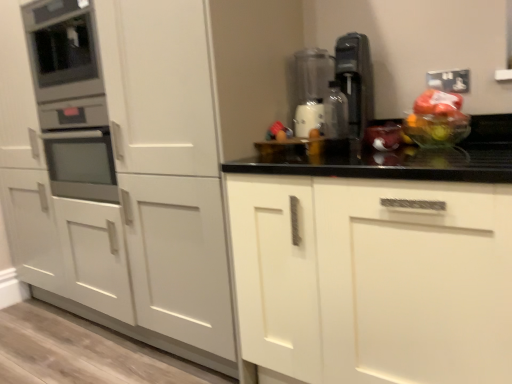
Question: From the image's perspective, is translucent plastic bag at center on metallic oven at left, positioned as the 1th appliance in left-to-right order?

Choices:
 (A) no
 (B) yes

Answer: (A)

Question: Is translucent plastic bag at center not inside metallic oven at left, placed as the second appliance when sorted from right to left?

Choices:
 (A) yes
 (B) no

Answer: (A)

Question: Does translucent plastic bag at center have a lesser width compared to metallic oven at left, placed as the second appliance when sorted from right to left?

Choices:
 (A) yes
 (B) no

Answer: (A)

Question: Does translucent plastic bag at center have a lesser height compared to metallic oven at left, placed as the second appliance when sorted from right to left?

Choices:
 (A) yes
 (B) no

Answer: (A)

Question: Can you confirm if translucent plastic bag at center is positioned to the right of metallic oven at left, placed as the second appliance when sorted from right to left?

Choices:
 (A) no
 (B) yes

Answer: (B)

Question: Looking at their shapes, would you say transparent plastic blender at center, the 1th appliance positioned from the right, is wider or thinner than translucent plastic bag at center?

Choices:
 (A) wide
 (B) thin

Answer: (B)

Question: Does point coord(300,92) appear closer or farther from the camera than point coord(385,142)?

Choices:
 (A) farther
 (B) closer

Answer: (A)

Question: Based on their sizes in the image, would you say transparent plastic blender at center, the 1th appliance positioned from the right, is bigger or smaller than translucent plastic bag at center?

Choices:
 (A) small
 (B) big

Answer: (B)

Question: From a real-world perspective, is transparent plastic blender at center, the 1th appliance positioned from the right, physically located above or below translucent plastic bag at center?

Choices:
 (A) below
 (B) above

Answer: (B)

Question: Visually, is white matte cabinet at center, arranged as the 1th cabinetry when viewed from the left, positioned to the left or to the right of translucent plastic bag of fruit at right?

Choices:
 (A) right
 (B) left

Answer: (B)

Question: From a real-world perspective, is white matte cabinet at center, arranged as the 1th cabinetry when viewed from the left, physically located above or below translucent plastic bag of fruit at right?

Choices:
 (A) below
 (B) above

Answer: (A)

Question: Is point (84, 256) positioned closer to the camera than point (446, 97)?

Choices:
 (A) closer
 (B) farther

Answer: (B)

Question: From the image's perspective, relative to translucent plastic bag of fruit at right, is white matte cabinet at center, arranged as the 1th cabinetry when viewed from the left, above or below?

Choices:
 (A) below
 (B) above

Answer: (A)

Question: Is point (329, 72) closer or farther from the camera than point (443, 115)?

Choices:
 (A) closer
 (B) farther

Answer: (B)

Question: From a real-world perspective, is transparent plastic blender at center, which is the 2th appliance from left to right, positioned above or below translucent plastic bag of fruit at right?

Choices:
 (A) above
 (B) below

Answer: (A)